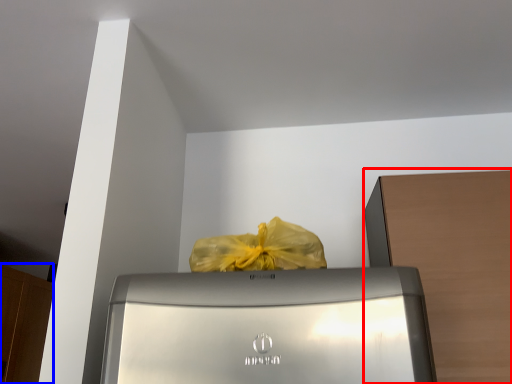
Question: Which point is further to the camera, cabinetry (highlighted by a red box) or cabinetry (highlighted by a blue box)?

Choices:
 (A) cabinetry
 (B) cabinetry

Answer: (B)